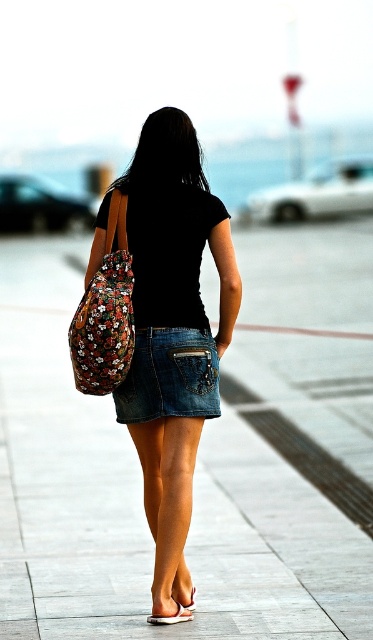
Question: Can you confirm if floral fabric bag at center is wider than white matte heel at lower center?

Choices:
 (A) yes
 (B) no

Answer: (A)

Question: Is the position of denim skirt at center more distant than that of floral fabric backpack at left?

Choices:
 (A) no
 (B) yes

Answer: (B)

Question: Is floral fabric bag at center above denim shorts at lower center?

Choices:
 (A) yes
 (B) no

Answer: (A)

Question: Which of the following is the closest to the observer?

Choices:
 (A) (127, 397)
 (B) (182, 326)
 (C) (29, 595)
 (D) (158, 621)

Answer: (D)

Question: Which object is farther from the camera taking this photo?

Choices:
 (A) denim shorts at lower center
 (B) floral fabric bag at center

Answer: (A)

Question: Which object appears farthest from the camera in this image?

Choices:
 (A) smooth concrete pavement at center
 (B) floral fabric bag at center
 (C) denim skirt at center
 (D) white matte heel at lower center

Answer: (C)